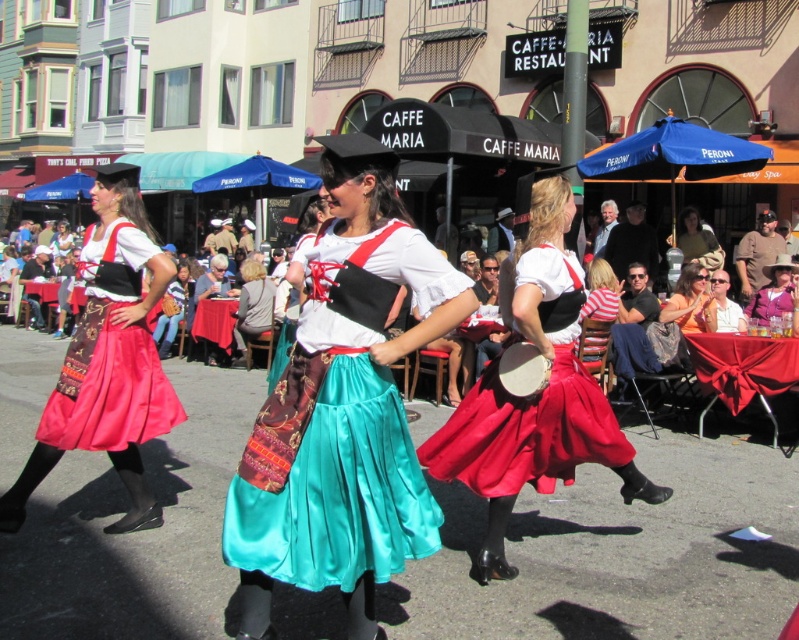
Is orange fabric dress at center bigger than matte black hat at upper center?

No, orange fabric dress at center is not bigger than matte black hat at upper center.

Who is more distant from viewer, (x=700, y=312) or (x=623, y=248)?

Positioned behind is point (x=623, y=248).

Find the location of a particular element. The height and width of the screenshot is (640, 799). orange fabric dress at center is located at coordinates (690, 301).

Find the location of a particular element. orange fabric dress at center is located at coordinates (690, 301).

Is orange fabric dress at center taller than white cotton shirt at center?

Yes.

The image size is (799, 640). What do you see at coordinates (690, 301) in the screenshot?
I see `orange fabric dress at center` at bounding box center [690, 301].

This screenshot has height=640, width=799. In order to click on orange fabric dress at center in this screenshot , I will do `click(690, 301)`.

Does point (758, 298) come behind point (158, 336)?

No, (758, 298) is closer to viewer.

Is pink satin skirt at center to the left of matte brown leather purse at center from the viewer's perspective?

Incorrect, pink satin skirt at center is not on the left side of matte brown leather purse at center.

Which is behind, point (786, 259) or point (165, 305)?

The point (165, 305) is more distant.

The height and width of the screenshot is (640, 799). I want to click on pink satin skirt at center, so click(772, 291).